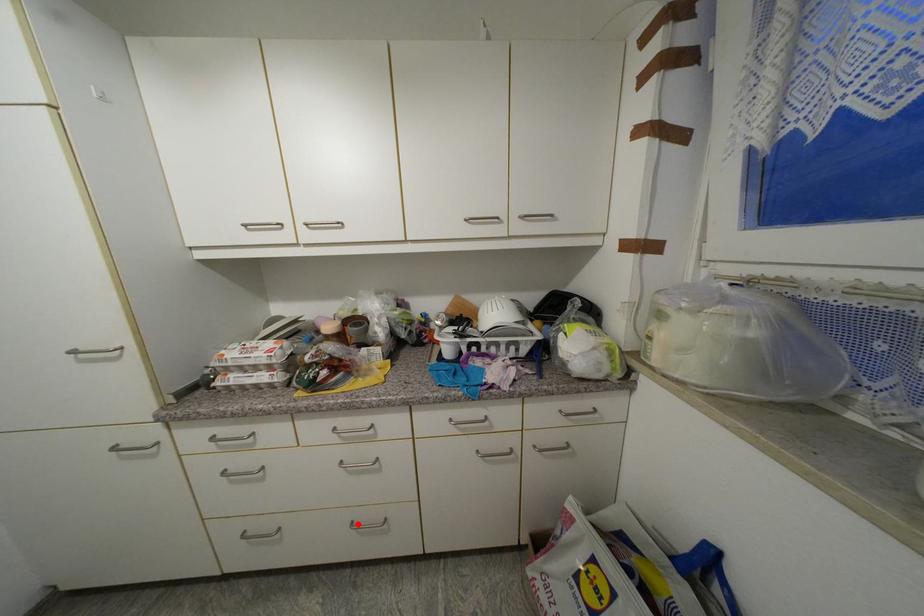
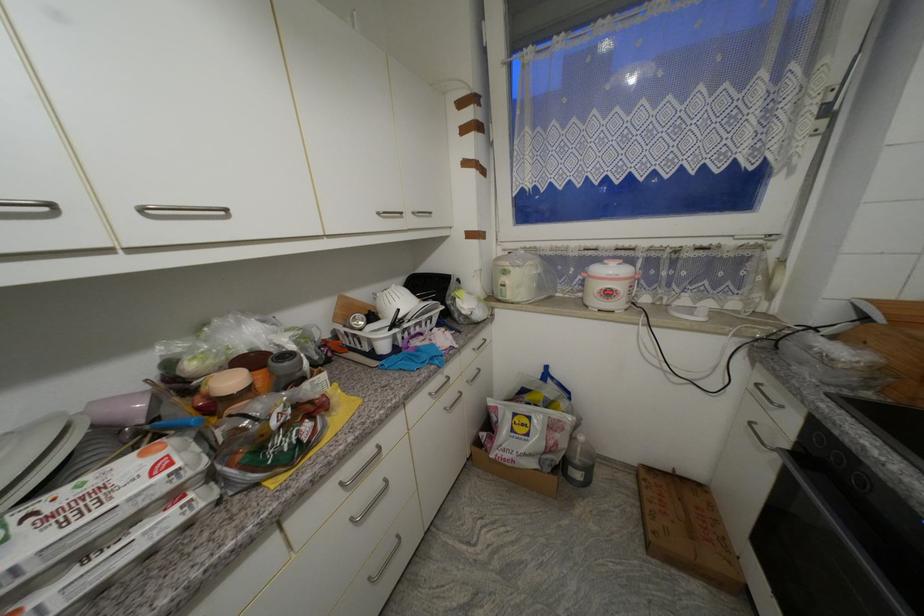
In the second image, find the point that corresponds to the highlighted location in the first image.

(375, 581)